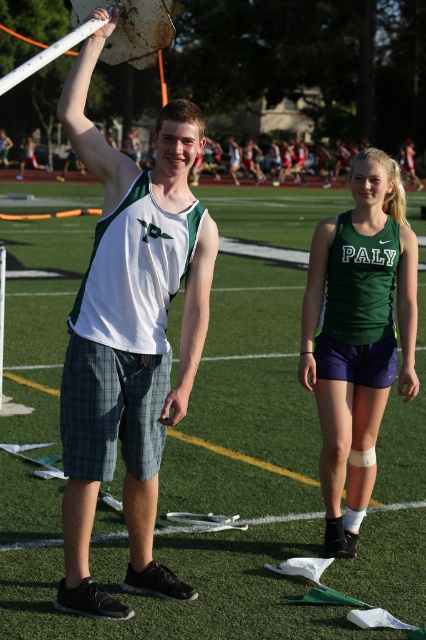
Question: Which is nearer to the green matte tank top at center?

Choices:
 (A) matte white tank top at center
 (B) green fabric field at center

Answer: (A)

Question: Is green fabric field at center closer to the viewer compared to green matte tank top at center?

Choices:
 (A) no
 (B) yes

Answer: (B)

Question: Which object is farther from the camera taking this photo?

Choices:
 (A) green matte tank top at center
 (B) green fabric field at center

Answer: (A)

Question: Which point appears farthest from the camera in this image?

Choices:
 (A) (327, 333)
 (B) (184, 141)

Answer: (A)

Question: Does matte white tank top at center appear under green matte tank top at center?

Choices:
 (A) yes
 (B) no

Answer: (B)

Question: Is matte white tank top at center further to camera compared to green matte tank top at center?

Choices:
 (A) no
 (B) yes

Answer: (A)